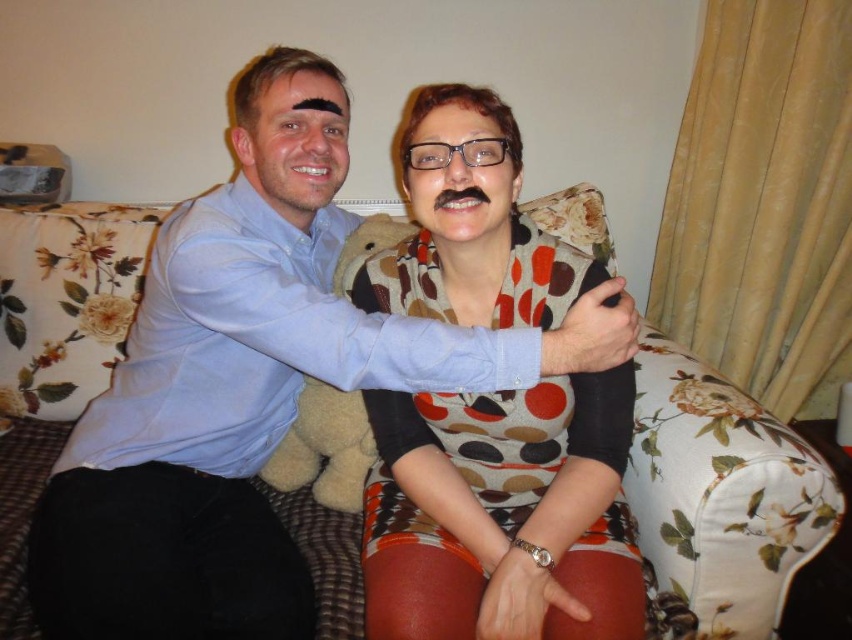
Question: Which point is farther to the camera?

Choices:
 (A) floral fabric couch at center
 (B) fuzzy beige teddy bear at center

Answer: (B)

Question: Among these objects, which one is farthest from the camera?

Choices:
 (A) polka dot sweater at center
 (B) floral fabric couch at center
 (C) fuzzy beige teddy bear at center

Answer: (C)

Question: Does floral fabric couch at center have a greater width compared to fuzzy beige teddy bear at center?

Choices:
 (A) no
 (B) yes

Answer: (B)

Question: Which of the following is the farthest from the observer?

Choices:
 (A) fuzzy beige teddy bear at center
 (B) polka dot sweater at center

Answer: (A)

Question: Can you confirm if floral fabric couch at center is positioned below fuzzy beige teddy bear at center?

Choices:
 (A) no
 (B) yes

Answer: (B)

Question: Does polka dot sweater at center appear over fuzzy beige teddy bear at center?

Choices:
 (A) no
 (B) yes

Answer: (A)